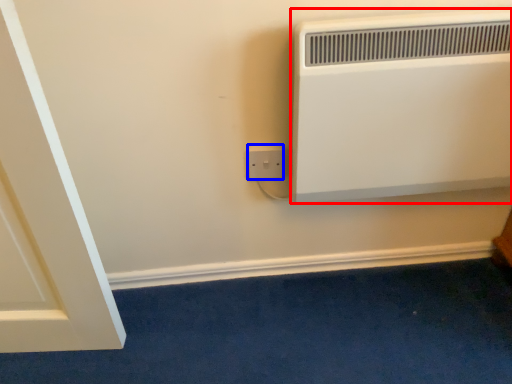
Question: Which point is further to the camera, heater (highlighted by a red box) or power plugs and sockets (highlighted by a blue box)?

Choices:
 (A) heater
 (B) power plugs and sockets

Answer: (B)